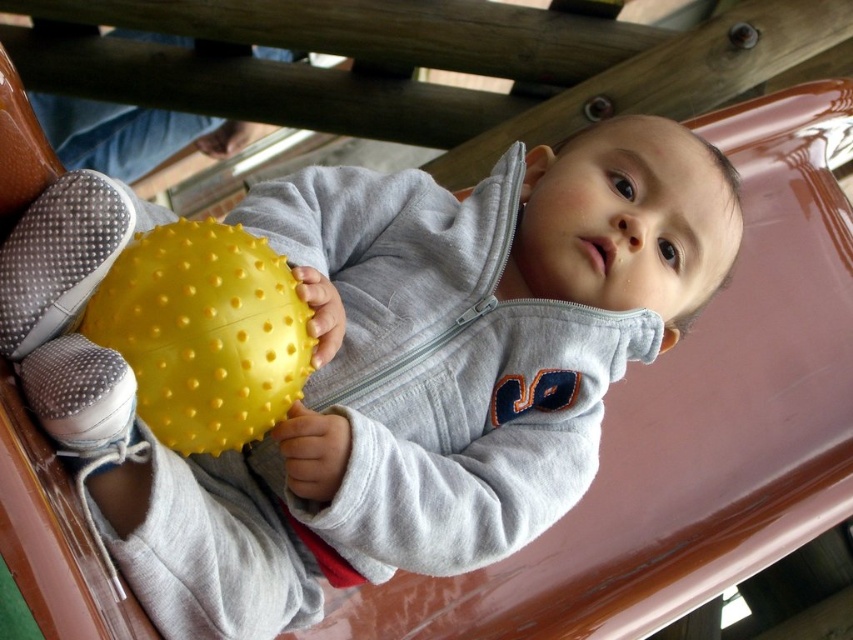
Which is above, matte yellow ball at center or yellow rubber ball at center?

Positioned higher is yellow rubber ball at center.

Looking at this image, who is more distant from viewer, (x=631, y=336) or (x=210, y=332)?

The point (x=631, y=336) is more distant.

I want to click on matte yellow ball at center, so click(381, 365).

Where is `matte yellow ball at center`? matte yellow ball at center is located at coordinates (381, 365).